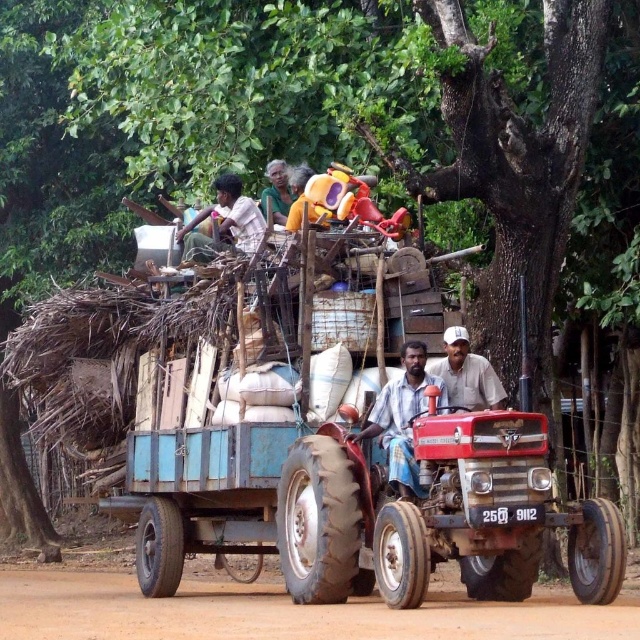
Between light brown fabric shirt at center and light brown wooden stick at upper center, which one appears on the left side from the viewer's perspective?

Positioned to the left is light brown wooden stick at upper center.

Is the position of light brown fabric shirt at center more distant than that of light brown wooden stick at upper center?

No, it is not.

Who is more forward, (400,476) or (276,192)?

Point (400,476)

Identify the location of light brown fabric shirt at center. The width and height of the screenshot is (640, 640). (403, 419).

Which is above, light brown fabric shirt at upper center or light brown wooden stick at upper center?

Positioned higher is light brown wooden stick at upper center.

Which is in front, point (246, 220) or point (266, 196)?

Point (246, 220)

Image resolution: width=640 pixels, height=640 pixels. What are the coordinates of `light brown fabric shirt at upper center` in the screenshot? It's located at (225, 224).

Who is higher up, white cotton shirt at center or light brown wooden stick at upper center?

light brown wooden stick at upper center is higher up.

Between point (456, 406) and point (276, 168), which one is positioned behind?

The point (276, 168) is behind.

This screenshot has height=640, width=640. Identify the location of white cotton shirt at center. (467, 374).